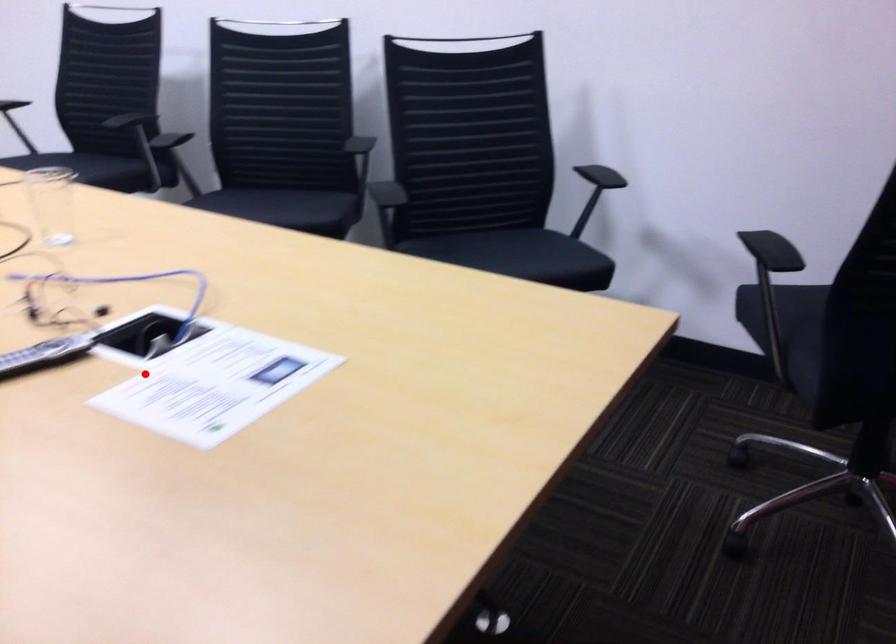
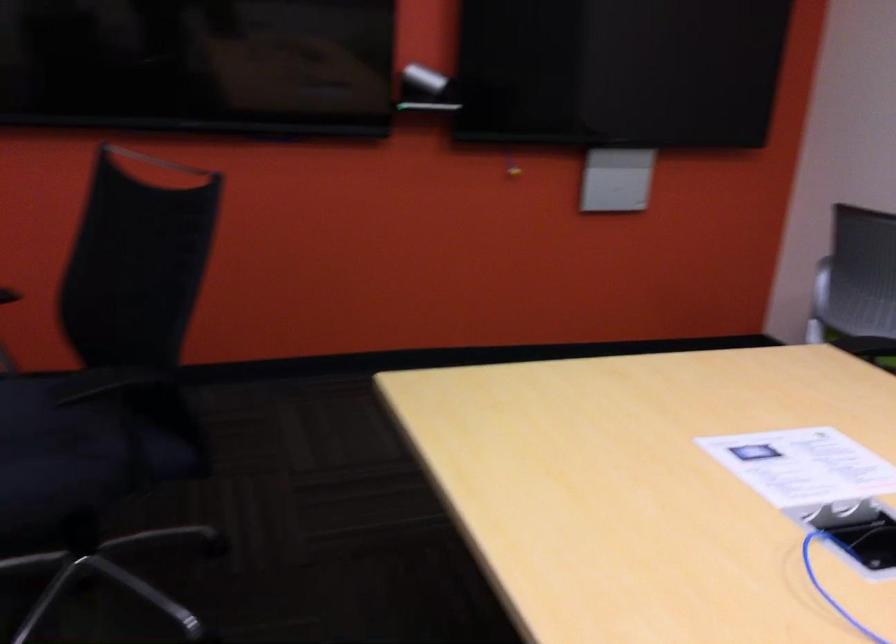
Find the pixel in the second image that matches the highlighted location in the first image.

(858, 532)